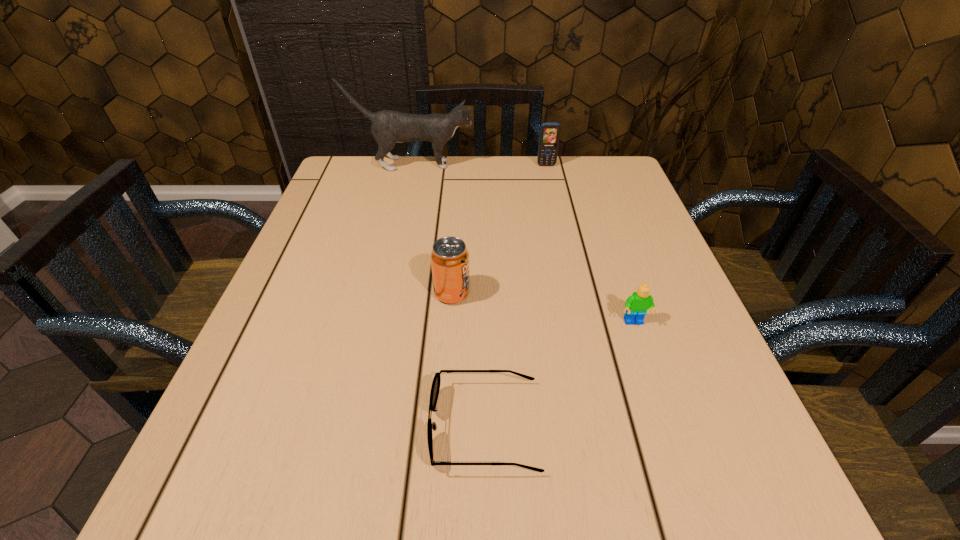
Identify the location of the tallest object. This screenshot has height=540, width=960. (388, 127).

Image resolution: width=960 pixels, height=540 pixels. I want to click on the fourth object from left to right, so click(549, 136).

Find the location of a particular element. the third farthest object is located at coordinates (449, 257).

This screenshot has height=540, width=960. In order to click on the second nearest object in this screenshot , I will do `click(637, 304)`.

This screenshot has height=540, width=960. I want to click on the second shortest object, so click(x=637, y=304).

Where is `the shortest object`? This screenshot has width=960, height=540. the shortest object is located at coordinates (435, 387).

Where is `spectacles`? This screenshot has height=540, width=960. spectacles is located at coordinates (435, 387).

I want to click on free spot located 0.250m at the face of the cat, so click(x=563, y=164).

Find the location of a particular element. The width and height of the screenshot is (960, 540). vacant space located on the screen of the cellular telephone is located at coordinates (549, 180).

You are a GUI agent. You are given a task and a screenshot of the screen. Output one action in this format:
    pyautogui.click(x=<x>, y=<y>)
    Task: Click on the free spot located on the back of the soda can
    Image resolution: width=960 pixels, height=540 pixels.
    Given the screenshot: What is the action you would take?
    pyautogui.click(x=459, y=180)